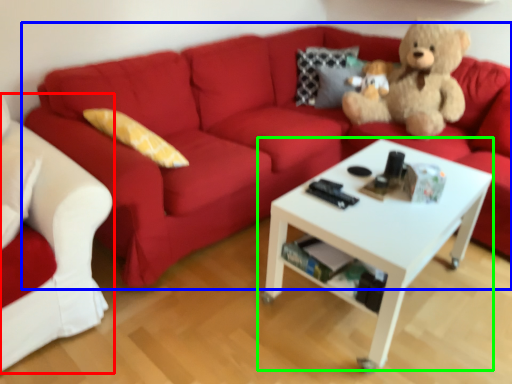
Question: Which is farther away from studio couch (highlighted by a red box)? studio couch (highlighted by a blue box) or coffee table (highlighted by a green box)?

Choices:
 (A) studio couch
 (B) coffee table

Answer: (B)